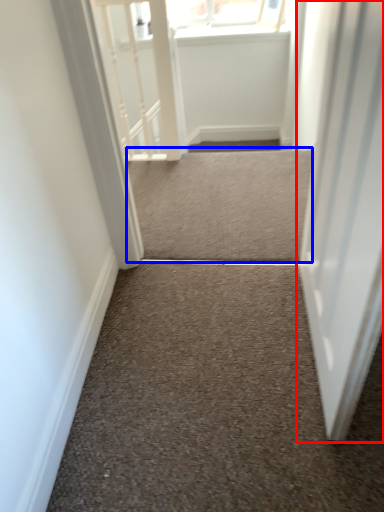
Question: Among these objects, which one is farthest to the camera, door (highlighted by a red box) or stairwell (highlighted by a blue box)?

Choices:
 (A) door
 (B) stairwell

Answer: (B)